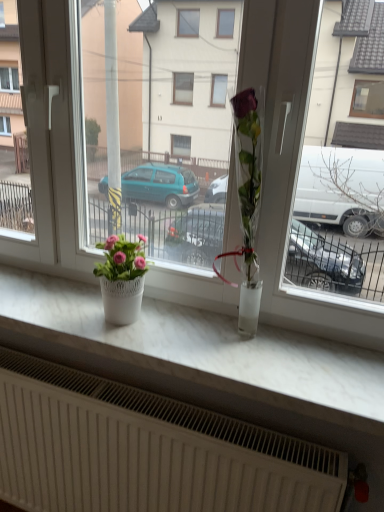
Where is `free space in front of pink matte flower pot at left`? The width and height of the screenshot is (384, 512). free space in front of pink matte flower pot at left is located at coordinates (131, 340).